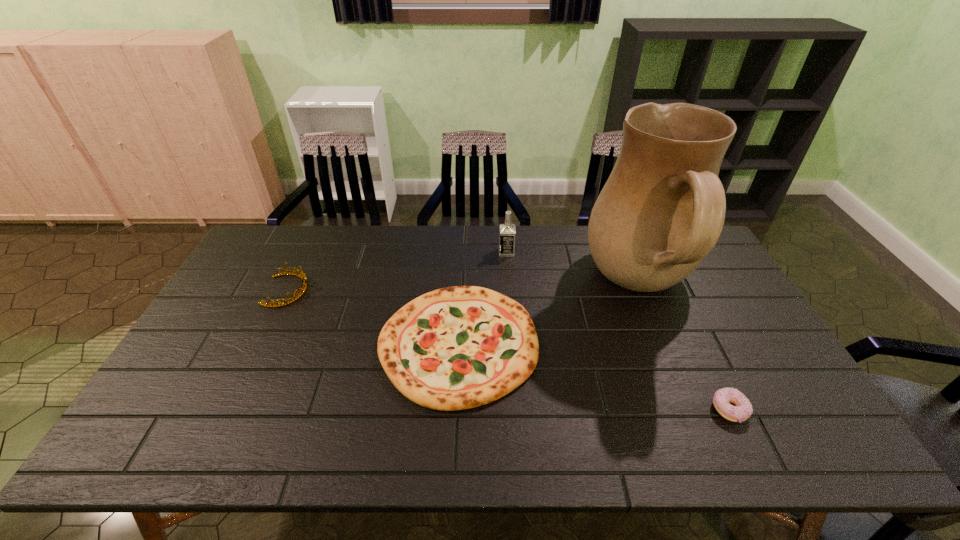
Locate an element on the screen. The width and height of the screenshot is (960, 540). vacant area in the image that satisfies the following two spatial constraints: 1. on the back side of the pizza; 2. on the front-facing side of the tiara is located at coordinates (461, 291).